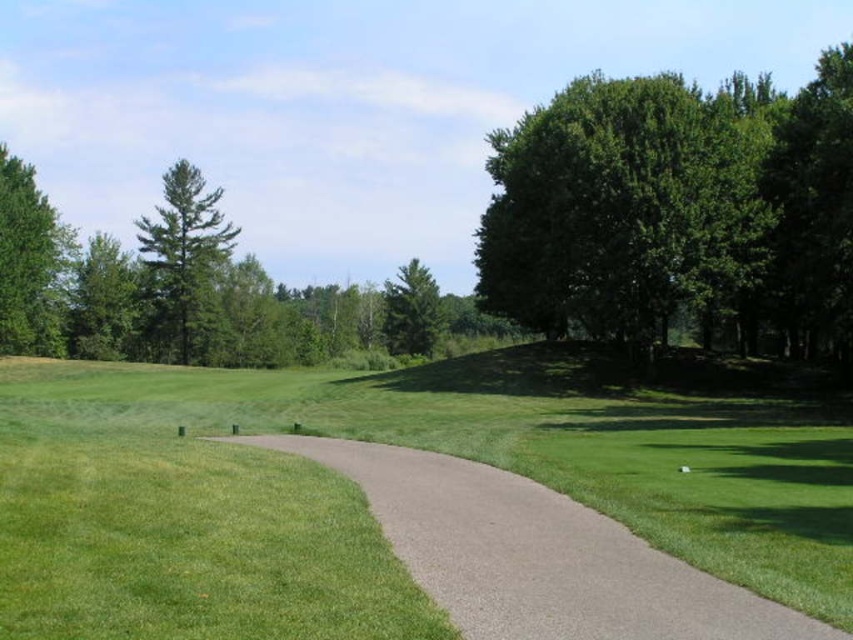
Does green leafy tree at left have a greater height compared to green matte tree at center?

In fact, green leafy tree at left may be shorter than green matte tree at center.

The image size is (853, 640). Describe the element at coordinates (28, 262) in the screenshot. I see `green leafy tree at left` at that location.

This screenshot has width=853, height=640. Find the location of `green leafy tree at left`. green leafy tree at left is located at coordinates (28, 262).

Which is in front, point (633, 218) or point (106, 339)?

Positioned in front is point (633, 218).

Looking at this image, does green leafy tree at upper right have a lesser height compared to green leafy tree at upper left?

In fact, green leafy tree at upper right may be taller than green leafy tree at upper left.

Is point (680, 99) closer to camera compared to point (105, 298)?

Yes, point (680, 99) is closer to viewer.

Where is `green leafy tree at upper right`? The width and height of the screenshot is (853, 640). green leafy tree at upper right is located at coordinates (627, 205).

In the scene shown: Is green leafy tree at upper right to the right of green matte tree at center from the viewer's perspective?

Indeed, green leafy tree at upper right is positioned on the right side of green matte tree at center.

Find the location of a particular element. green leafy tree at upper right is located at coordinates (627, 205).

Where is `green leafy tree at upper right`? green leafy tree at upper right is located at coordinates (627, 205).